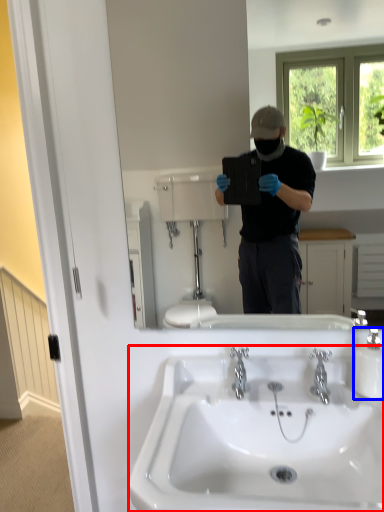
Question: Which point is closer to the camera, sink (highlighted by a red box) or bottle (highlighted by a blue box)?

Choices:
 (A) sink
 (B) bottle

Answer: (A)